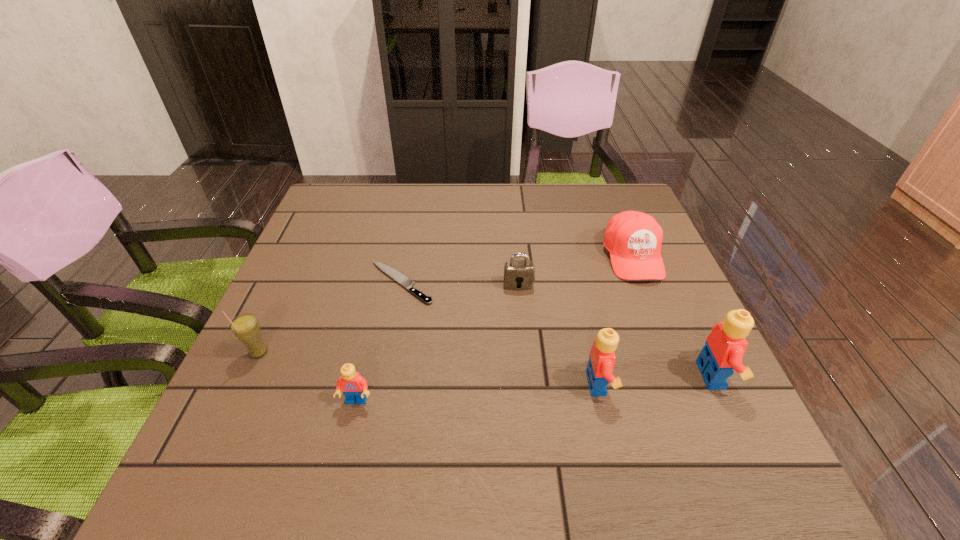
I want to click on vacant area that lies between the shortest Lego and the third object from right to left, so click(x=477, y=393).

Locate which object is the third closest to the fourth object from right to left. Please provide its 2D coordinates. Your answer should be formatted as a tuple, i.e. [(x, y)], where the tuple contains the x and y coordinates of a point satisfying the conditions above.

[(599, 371)]

Image resolution: width=960 pixels, height=540 pixels. Find the location of `object that stands as the second closest to the baseball cap`. object that stands as the second closest to the baseball cap is located at coordinates (725, 346).

Identify which Lego is the nearest to the shortest object. Please provide its 2D coordinates. Your answer should be formatted as a tuple, i.e. [(x, y)], where the tuple contains the x and y coordinates of a point satisfying the conditions above.

[(354, 387)]

Select which Lego appears as the closest to the leftmost object. Please provide its 2D coordinates. Your answer should be formatted as a tuple, i.e. [(x, y)], where the tuple contains the x and y coordinates of a point satisfying the conditions above.

[(354, 387)]